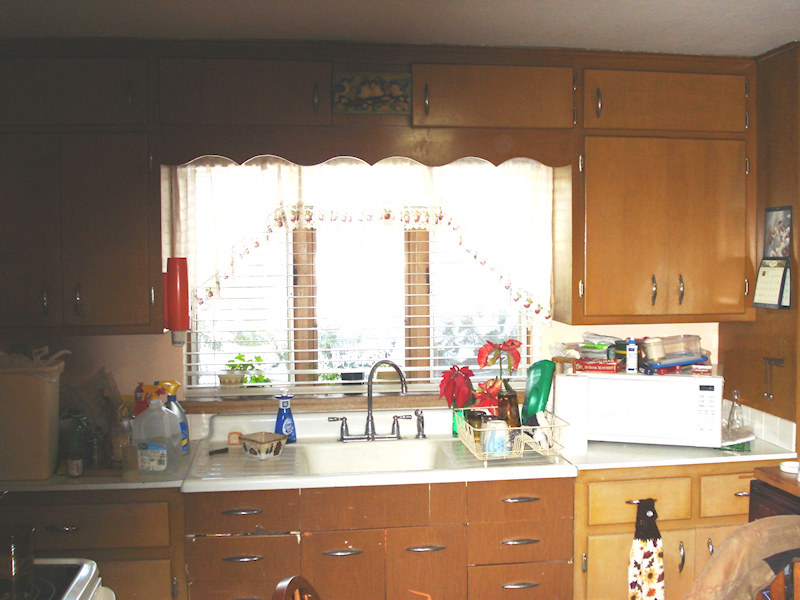
Image resolution: width=800 pixels, height=600 pixels. What are the coordinates of `right edge of stove top` in the screenshot? It's located at tap(93, 561).